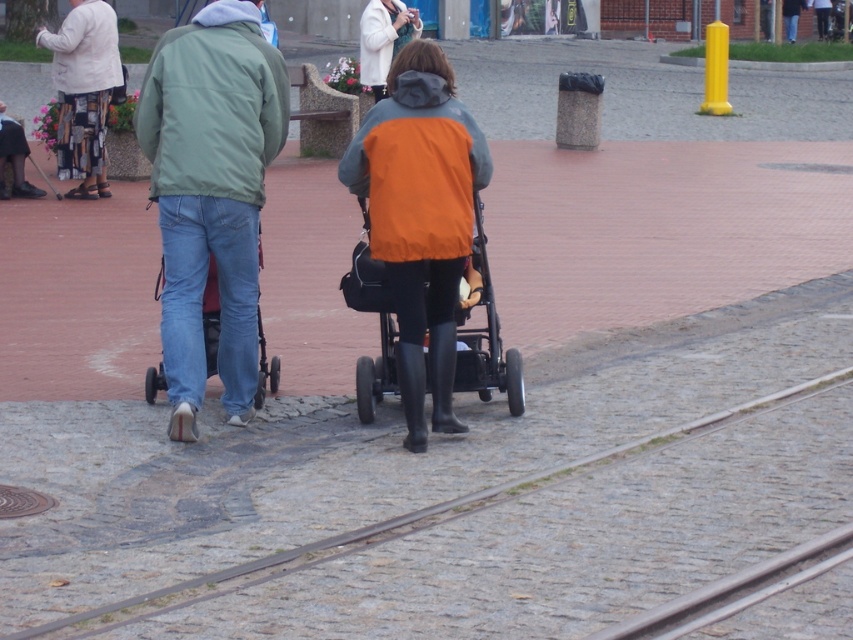
Can you confirm if green matte jacket at center is positioned below orange fabric stroller at center?

No, green matte jacket at center is not below orange fabric stroller at center.

Where is `green matte jacket at center`? The image size is (853, 640). green matte jacket at center is located at coordinates (212, 193).

Is green matte jacket at center to the right of white wool coat at upper center from the viewer's perspective?

In fact, green matte jacket at center is to the left of white wool coat at upper center.

Which is above, green matte jacket at center or white wool coat at upper center?

white wool coat at upper center is above.

Find the location of `green matte jacket at center`. green matte jacket at center is located at coordinates (212, 193).

Between orange matte vest at center and white textured jacket at upper left, which one appears on the right side from the viewer's perspective?

Positioned to the right is orange matte vest at center.

This screenshot has width=853, height=640. What are the coordinates of `orange matte vest at center` in the screenshot? It's located at click(421, 218).